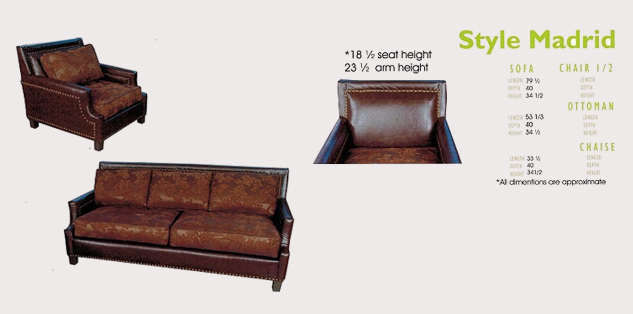
Locate an element on the screen. Image resolution: width=633 pixels, height=314 pixels. left front couch leg is located at coordinates (277, 287).